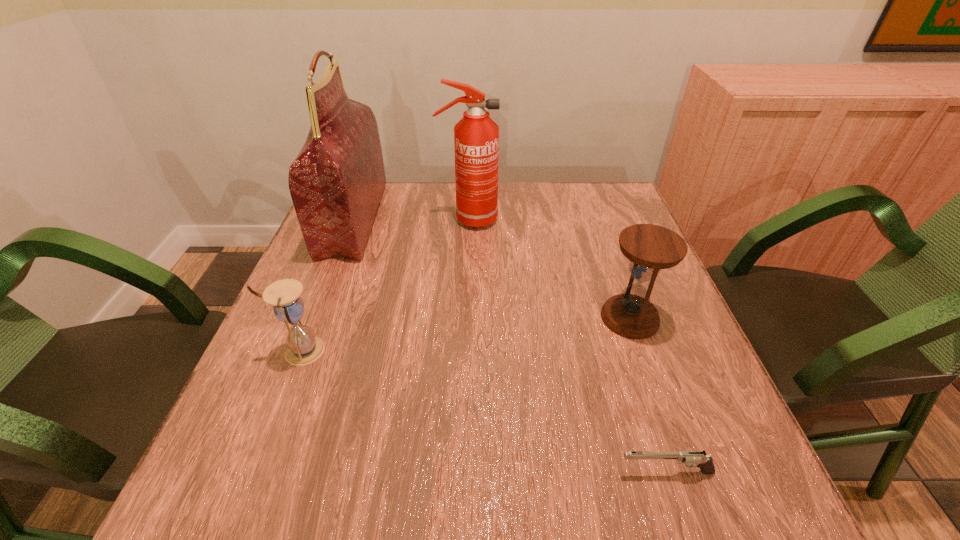
Choose which object is the nearest neighbor to the handbag. Please provide its 2D coordinates. Your answer should be formatted as a tuple, i.e. [(x, y)], where the tuple contains the x and y coordinates of a point satisfying the conditions above.

[(476, 136)]

Locate an element on the screen. object that is the closest one to the handbag is located at coordinates (476, 136).

I want to click on vacant area in the image that satisfies the following two spatial constraints: 1. on the front-facing side of the right hourglass; 2. on the right side of the handbag, so (x=316, y=318).

I want to click on vacant area that satisfies the following two spatial constraints: 1. at the nozzle of the right hourglass; 2. on the left side of the third object from left to right, so click(465, 318).

At what (x,y) coordinates should I click in order to perform the action: click on vacant area in the image that satisfies the following two spatial constraints: 1. on the front side of the right hourglass; 2. on the front-facing side of the nearest object. Please return your answer as a coordinate pair (x, y). This screenshot has height=540, width=960. Looking at the image, I should click on pyautogui.click(x=684, y=472).

Where is `free space that satisfies the following two spatial constraints: 1. on the front-facing side of the handbag; 2. on the back side of the right hourglass`? The width and height of the screenshot is (960, 540). free space that satisfies the following two spatial constraints: 1. on the front-facing side of the handbag; 2. on the back side of the right hourglass is located at coordinates (316, 318).

Where is `vacant region that satisfies the following two spatial constraints: 1. on the back side of the right hourglass; 2. on the left side of the left hourglass`? The height and width of the screenshot is (540, 960). vacant region that satisfies the following two spatial constraints: 1. on the back side of the right hourglass; 2. on the left side of the left hourglass is located at coordinates (314, 318).